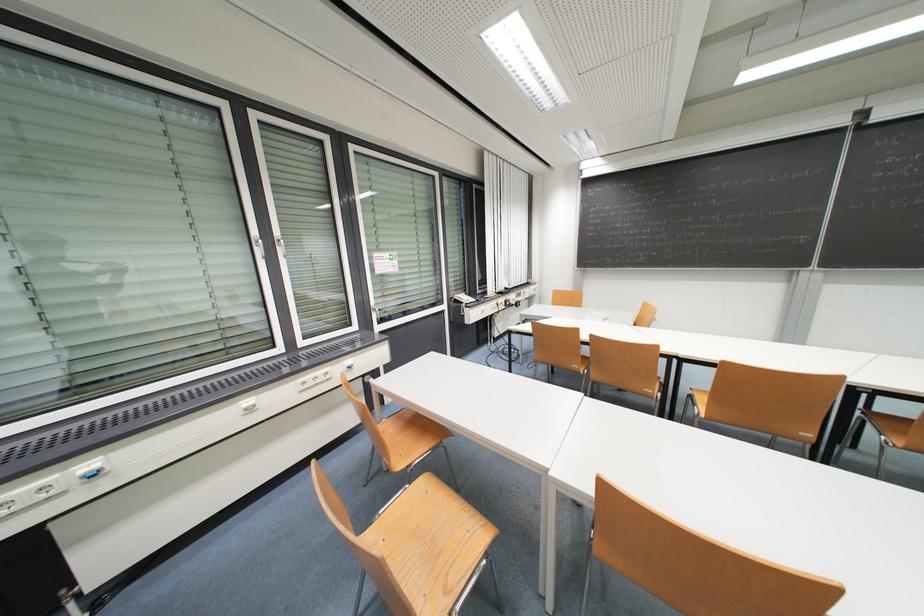
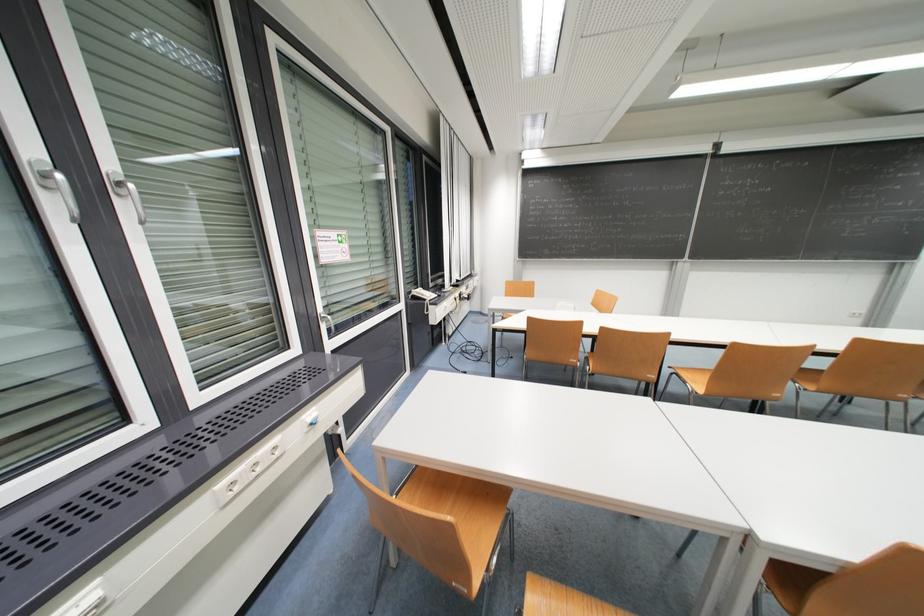
Find the pixel in the second image that matches point 285,243 in the first image.

(126, 185)